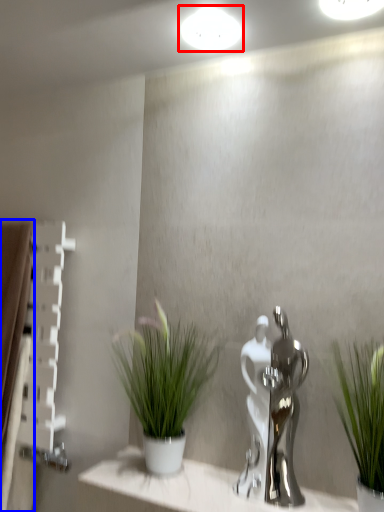
Question: Which of the following is the farthest to the observer, lighting (highlighted by a red box) or curtain (highlighted by a blue box)?

Choices:
 (A) lighting
 (B) curtain

Answer: (B)